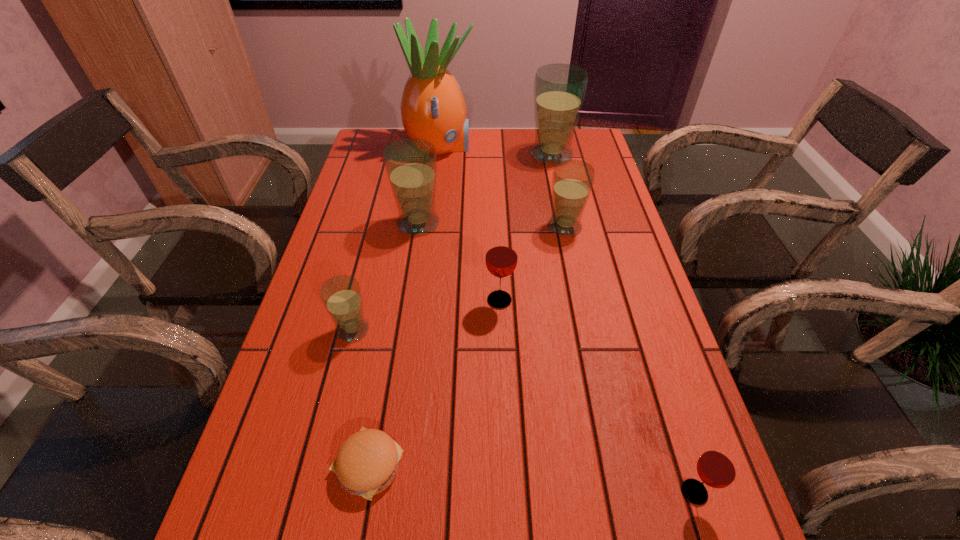
Image resolution: width=960 pixels, height=540 pixels. I want to click on free spot that satisfies the following two spatial constraints: 1. at the entrance of the pineapple; 2. on the back side of the second smallest blue glass, so [430, 226].

Identify the location of free space that satisfies the following two spatial constraints: 1. on the back side of the farthest glass; 2. at the entrance of the orange pineapple. The height and width of the screenshot is (540, 960). (550, 147).

Image resolution: width=960 pixels, height=540 pixels. Identify the location of vacant space that satisfies the following two spatial constraints: 1. on the back side of the patty; 2. on the right side of the farthest glass. (421, 155).

Where is `vacant space that satisfies the following two spatial constraints: 1. on the back side of the fifth farthest glass; 2. on the right side of the second smallest blue glass`? The image size is (960, 540). vacant space that satisfies the following two spatial constraints: 1. on the back side of the fifth farthest glass; 2. on the right side of the second smallest blue glass is located at coordinates (378, 226).

This screenshot has height=540, width=960. Identify the location of free point that satisfies the following two spatial constraints: 1. on the back side of the farthest glass; 2. on the left side of the fourth farthest glass. (493, 155).